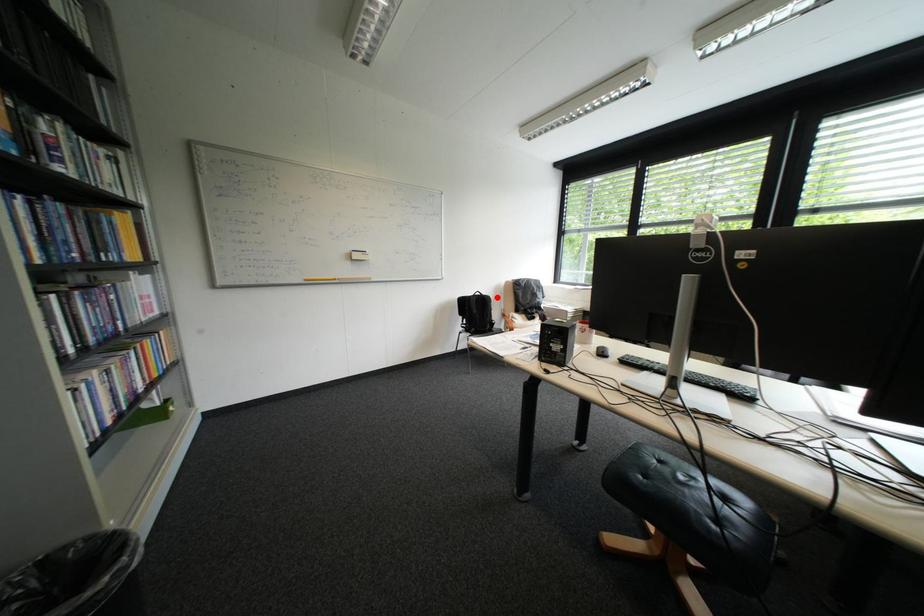
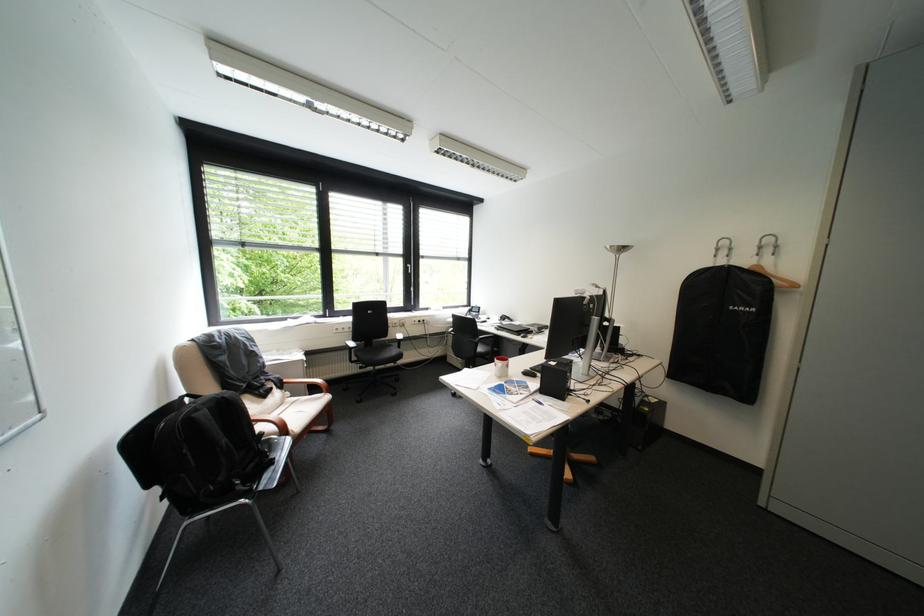
Find the pixel in the second image that matches the highlighted location in the first image.

(236, 398)